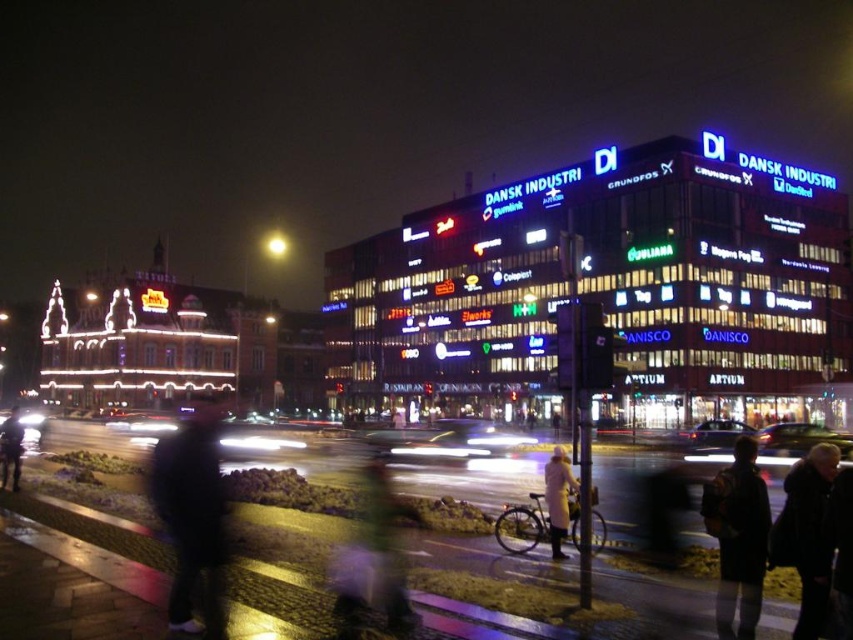
You are a photographer standing in the city at night. You notice two jackets in the scene. The dark fabric jacket at lower right and the green fabric jacket at center. Which jacket is positioned higher in the image?

The dark fabric jacket at lower right is located above the green fabric jacket at center, so it is positioned higher in the image.

You are a delivery person who needs to place a package between the black matte jacket at lower right and the dark blue jacket at lower left. The package is 55 meters long. Will it fit between them?

The distance between the black matte jacket at lower right and the dark blue jacket at lower left is 55.25 meters, so the 55 meters long package will fit between them with a remaining space of 0.25 meters.

You are a photographer standing in the city at night. You want to take a photo of both the dark fabric jacket at lower right and the green fabric jacket at center. Which jacket should you focus on first to ensure both are in clear view?

You should focus on the dark fabric jacket at lower right first because it is closer to you than the green fabric jacket at center. By focusing on the closer jacket, you can ensure both jackets are in acceptable focus due to the depth of field.